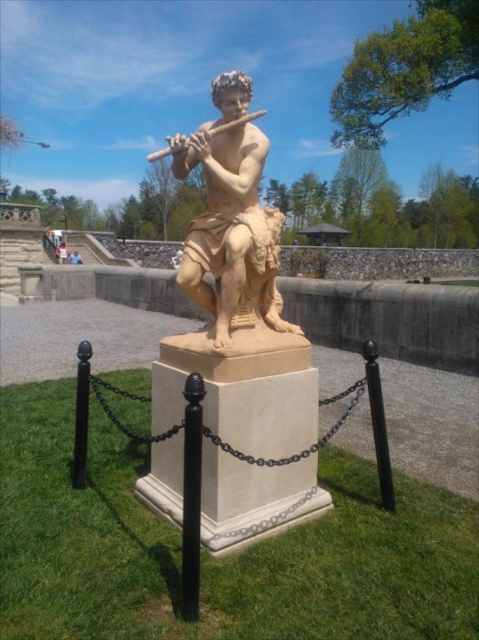
Which is behind, point (191, 385) or point (79, 445)?

The point (79, 445) is behind.

Is black metal pole at center to the left of black metal pole at lower left from the viewer's perspective?

Incorrect, black metal pole at center is not on the left side of black metal pole at lower left.

Who is more distant from viewer, (184, 524) or (80, 376)?

Point (80, 376)

Identify the location of black metal pole at center. pyautogui.click(x=192, y=497).

Does beige stone statue at center have a lesser height compared to black metal pole at lower left?

No, beige stone statue at center is not shorter than black metal pole at lower left.

Is point (241, 205) less distant than point (79, 442)?

Yes, point (241, 205) is closer to viewer.

The width and height of the screenshot is (479, 640). What do you see at coordinates (230, 218) in the screenshot?
I see `beige stone statue at center` at bounding box center [230, 218].

Find the location of `beige stone statue at center`. beige stone statue at center is located at coordinates [230, 218].

Is beige stone statue at center positioned at the back of black polished metal pole at center right?

No, beige stone statue at center is closer to the viewer.

Identify the location of beige stone statue at center. (230, 218).